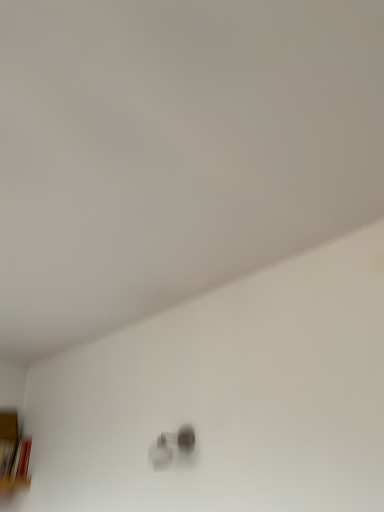
What do you see at coordinates (21, 459) in the screenshot? This screenshot has width=384, height=512. I see `hardcover book at lower left` at bounding box center [21, 459].

What are the coordinates of `hardcover book at lower left` in the screenshot? It's located at (21, 459).

Locate an element on the screen. hardcover book at lower left is located at coordinates (21, 459).